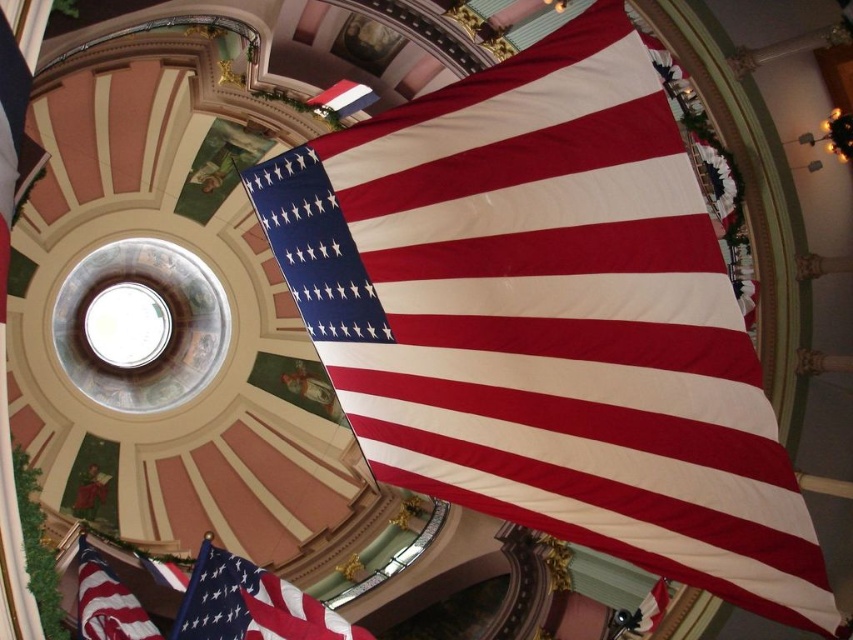
Question: Does matte fabric flag at center have a lesser width compared to matte fabric flag at lower left?

Choices:
 (A) no
 (B) yes

Answer: (A)

Question: Among these objects, which one is nearest to the camera?

Choices:
 (A) white glossy flag at center
 (B) matte cotton flag at center
 (C) matte red flag at lower left
 (D) matte fabric flag at center

Answer: (D)

Question: Which point is farther to the camera?

Choices:
 (A) (283, 625)
 (B) (80, 612)

Answer: (B)

Question: Is white glossy flag at center bigger than matte white flag at center?

Choices:
 (A) no
 (B) yes

Answer: (B)

Question: Does matte fabric flag at center appear on the right side of matte red flag at lower left?

Choices:
 (A) no
 (B) yes

Answer: (B)

Question: Which object is positioned farthest from the matte red flag at lower left?

Choices:
 (A) matte cotton flag at center
 (B) matte white flag at center

Answer: (B)